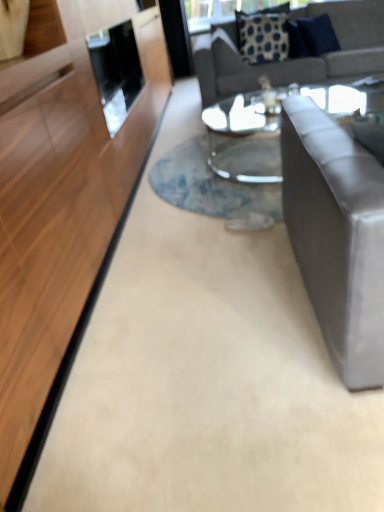
How much space does gray fabric couch at upper right, which is the 1th studio couch in top-to-bottom order, occupy horizontally?

It is 1.21 meters.

The width and height of the screenshot is (384, 512). Find the location of `clear glass coffee table at center`. clear glass coffee table at center is located at coordinates (244, 139).

You are a GUI agent. You are given a task and a screenshot of the screen. Output one action in this format:
    pyautogui.click(x=<x>, y=<y>)
    Task: Click on the blue fabric pillow at upper right, positioned as the 1th pillow in right-to-left order
    This screenshot has height=512, width=384.
    Given the screenshot: What is the action you would take?
    pyautogui.click(x=311, y=37)

The height and width of the screenshot is (512, 384). What do you see at coordinates (337, 236) in the screenshot? I see `satin gray couch at right, placed as the second studio couch when sorted from top to bottom` at bounding box center [337, 236].

The height and width of the screenshot is (512, 384). What are the coordinates of `gray fabric couch at upper right, the first studio couch when ordered from back to front` in the screenshot? It's located at (294, 59).

From a real-world perspective, which object rests below the other?

From a 3D spatial view, clear glass coffee table at center is below.

Is blue dotted fabric pillow at upper center, the second pillow in the right-to-left sequence, facing away from clear glass coffee table at center?

blue dotted fabric pillow at upper center, the second pillow in the right-to-left sequence, is not turned away from clear glass coffee table at center.

Is blue dotted fabric pillow at upper center, the 1th pillow in the left-to-right sequence, not inside clear glass coffee table at center?

Yes, blue dotted fabric pillow at upper center, the 1th pillow in the left-to-right sequence, is outside of clear glass coffee table at center.

Measure the distance from blue dotted fabric pillow at upper center, the 1th pillow in the left-to-right sequence, to blue fabric pillow at upper right, positioned as the 1th pillow in right-to-left order.

blue dotted fabric pillow at upper center, the 1th pillow in the left-to-right sequence, is 8.66 inches from blue fabric pillow at upper right, positioned as the 1th pillow in right-to-left order.

Which is closer, (252,25) or (323,24)?

Point (323,24)

From a real-world perspective, is blue dotted fabric pillow at upper center, the 1th pillow in the left-to-right sequence, physically above blue fabric pillow at upper right, positioned as the 1th pillow in right-to-left order?

Yes.

This screenshot has height=512, width=384. What are the coordinates of `pillow that is above the blue dotted fabric pillow at upper center, the second pillow in the right-to-left sequence (from the image's perspective)` in the screenshot? It's located at (311, 37).

In the image, is blue dotted fabric pillow at upper center, the second pillow in the right-to-left sequence, on the left side or the right side of satin gray couch at right, which appears as the 1th studio couch when ordered from the bottom?

In the image, blue dotted fabric pillow at upper center, the second pillow in the right-to-left sequence, appears on the right side of satin gray couch at right, which appears as the 1th studio couch when ordered from the bottom.

Looking at the image, does blue dotted fabric pillow at upper center, the second pillow in the right-to-left sequence, seem bigger or smaller compared to satin gray couch at right, which appears as the 1th studio couch when ordered from the bottom?

blue dotted fabric pillow at upper center, the second pillow in the right-to-left sequence, is smaller than satin gray couch at right, which appears as the 1th studio couch when ordered from the bottom.

Is satin gray couch at right, which appears as the 1th studio couch when ordered from the bottom, completely or partially inside blue dotted fabric pillow at upper center, the 1th pillow in the left-to-right sequence?

No, satin gray couch at right, which appears as the 1th studio couch when ordered from the bottom, is located outside of blue dotted fabric pillow at upper center, the 1th pillow in the left-to-right sequence.

Does clear glass coffee table at center have a smaller size compared to gray fabric couch at upper right, which appears as the second studio couch when viewed from the front?

Indeed, clear glass coffee table at center has a smaller size compared to gray fabric couch at upper right, which appears as the second studio couch when viewed from the front.

Would you say gray fabric couch at upper right, which appears as the second studio couch when viewed from the front, is part of clear glass coffee table at center's contents?

No, gray fabric couch at upper right, which appears as the second studio couch when viewed from the front, is not inside clear glass coffee table at center.

Between clear glass coffee table at center and gray fabric couch at upper right, the first studio couch when ordered from back to front, which one has smaller width?

gray fabric couch at upper right, the first studio couch when ordered from back to front, is thinner.

Is blue dotted fabric pillow at upper center, the 1th pillow in the left-to-right sequence, at the back of gray fabric couch at upper right, which is the 1th studio couch in top-to-bottom order?

A: That's right, gray fabric couch at upper right, which is the 1th studio couch in top-to-bottom order, is facing away from blue dotted fabric pillow at upper center, the 1th pillow in the left-to-right sequence.

In the scene shown: From a real-world perspective, which object rests below the other?

gray fabric couch at upper right, the second studio couch ordered from the bottom.

How different are the orientations of gray fabric couch at upper right, which is the 1th studio couch in top-to-bottom order, and blue dotted fabric pillow at upper center, the second pillow in the right-to-left sequence, in degrees?

The angular difference between gray fabric couch at upper right, which is the 1th studio couch in top-to-bottom order, and blue dotted fabric pillow at upper center, the second pillow in the right-to-left sequence, is 0.215 degrees.

From the image's perspective, is gray fabric couch at upper right, the second studio couch ordered from the bottom, located beneath blue dotted fabric pillow at upper center, the second pillow in the right-to-left sequence?

Yes.

The width and height of the screenshot is (384, 512). I want to click on coffee table on the left of blue fabric pillow at upper right, which is the 2th pillow from left to right, so click(244, 139).

Is clear glass coffee table at center not near blue fabric pillow at upper right, positioned as the 1th pillow in right-to-left order?

Yes, clear glass coffee table at center and blue fabric pillow at upper right, positioned as the 1th pillow in right-to-left order, are quite far apart.

From a real-world perspective, between clear glass coffee table at center and blue fabric pillow at upper right, positioned as the 1th pillow in right-to-left order, who is vertically higher?

From a 3D spatial view, blue fabric pillow at upper right, positioned as the 1th pillow in right-to-left order, is above.

Is blue fabric pillow at upper right, which is the 2th pillow from left to right, at the back of clear glass coffee table at center?

No, blue fabric pillow at upper right, which is the 2th pillow from left to right, is not at the back of clear glass coffee table at center.

Is the position of blue fabric pillow at upper right, which is the 2th pillow from left to right, less distant than that of blue dotted fabric pillow at upper center, the 1th pillow in the left-to-right sequence?

Yes, the depth of blue fabric pillow at upper right, which is the 2th pillow from left to right, is less than that of blue dotted fabric pillow at upper center, the 1th pillow in the left-to-right sequence.

At what (x,y) coordinates should I click in order to perform the action: click on pillow located on the right of blue dotted fabric pillow at upper center, the second pillow in the right-to-left sequence. Please return your answer as a coordinate pair (x, y). This screenshot has height=512, width=384. Looking at the image, I should click on (311, 37).

Between blue fabric pillow at upper right, positioned as the 1th pillow in right-to-left order, and blue dotted fabric pillow at upper center, the 1th pillow in the left-to-right sequence, which one has smaller width?

blue dotted fabric pillow at upper center, the 1th pillow in the left-to-right sequence, is thinner.

From a real-world perspective, is blue fabric pillow at upper right, positioned as the 1th pillow in right-to-left order, on blue dotted fabric pillow at upper center, the second pillow in the right-to-left sequence?

No, from a real-world perspective, blue fabric pillow at upper right, positioned as the 1th pillow in right-to-left order, is not over blue dotted fabric pillow at upper center, the second pillow in the right-to-left sequence

Locate an element on the screen. The image size is (384, 512). coffee table that appears in front of the blue dotted fabric pillow at upper center, the 1th pillow in the left-to-right sequence is located at coordinates (244, 139).

This screenshot has width=384, height=512. Find the location of `pillow that appears above the blue fabric pillow at upper right, positioned as the 1th pillow in right-to-left order (from a real-world perspective)`. pillow that appears above the blue fabric pillow at upper right, positioned as the 1th pillow in right-to-left order (from a real-world perspective) is located at coordinates (263, 34).

Based on their spatial positions, is clear glass coffee table at center or satin gray couch at right, which ranks as the 2th studio couch in back-to-front order, closer to gray fabric couch at upper right, the second studio couch ordered from the bottom?

clear glass coffee table at center lies closer to gray fabric couch at upper right, the second studio couch ordered from the bottom, than the other object.

Which object lies further to the anchor point blue fabric pillow at upper right, which is the 2th pillow from left to right, satin gray couch at right, placed as the second studio couch when sorted from top to bottom, or gray fabric couch at upper right, the second studio couch ordered from the bottom?

satin gray couch at right, placed as the second studio couch when sorted from top to bottom, is further to blue fabric pillow at upper right, which is the 2th pillow from left to right.

Which object lies further to the anchor point gray fabric couch at upper right, the second studio couch ordered from the bottom, satin gray couch at right, which appears as the 1th studio couch when ordered from the bottom, or blue dotted fabric pillow at upper center, the second pillow in the right-to-left sequence?

satin gray couch at right, which appears as the 1th studio couch when ordered from the bottom, is further to gray fabric couch at upper right, the second studio couch ordered from the bottom.

Based on their spatial positions, is blue fabric pillow at upper right, which is the 2th pillow from left to right, or satin gray couch at right, which ranks as the 2th studio couch in back-to-front order, closer to blue dotted fabric pillow at upper center, the 1th pillow in the left-to-right sequence?

blue fabric pillow at upper right, which is the 2th pillow from left to right, is positioned closer to the anchor blue dotted fabric pillow at upper center, the 1th pillow in the left-to-right sequence.

Estimate the real-world distances between objects in this image. Which object is closer to clear glass coffee table at center, blue fabric pillow at upper right, which is the 2th pillow from left to right, or blue dotted fabric pillow at upper center, the 1th pillow in the left-to-right sequence?

Among the two, blue dotted fabric pillow at upper center, the 1th pillow in the left-to-right sequence, is located nearer to clear glass coffee table at center.

From the image, which object appears to be nearer to satin gray couch at right, which ranks as the 2th studio couch in back-to-front order, clear glass coffee table at center or gray fabric couch at upper right, which appears as the second studio couch when viewed from the front?

Based on the image, clear glass coffee table at center appears to be nearer to satin gray couch at right, which ranks as the 2th studio couch in back-to-front order.

Estimate the real-world distances between objects in this image. Which object is closer to blue dotted fabric pillow at upper center, the 1th pillow in the left-to-right sequence, satin gray couch at right, acting as the 1th studio couch starting from the front, or gray fabric couch at upper right, which appears as the second studio couch when viewed from the front?

gray fabric couch at upper right, which appears as the second studio couch when viewed from the front.

Based on their spatial positions, is gray fabric couch at upper right, which appears as the second studio couch when viewed from the front, or clear glass coffee table at center closer to blue dotted fabric pillow at upper center, the second pillow in the right-to-left sequence?

gray fabric couch at upper right, which appears as the second studio couch when viewed from the front, is closer to blue dotted fabric pillow at upper center, the second pillow in the right-to-left sequence.

Where is `pillow between clear glass coffee table at center and blue dotted fabric pillow at upper center, the 1th pillow in the left-to-right sequence, in the front-back direction`? This screenshot has height=512, width=384. pillow between clear glass coffee table at center and blue dotted fabric pillow at upper center, the 1th pillow in the left-to-right sequence, in the front-back direction is located at coordinates (311, 37).

Locate an element on the screen. coffee table between satin gray couch at right, acting as the 1th studio couch starting from the front, and blue dotted fabric pillow at upper center, the 1th pillow in the left-to-right sequence, from front to back is located at coordinates (244, 139).

Where is `studio couch between satin gray couch at right, acting as the 1th studio couch starting from the front, and blue dotted fabric pillow at upper center, the 1th pillow in the left-to-right sequence, in the front-back direction`? studio couch between satin gray couch at right, acting as the 1th studio couch starting from the front, and blue dotted fabric pillow at upper center, the 1th pillow in the left-to-right sequence, in the front-back direction is located at coordinates (294, 59).

Where is `studio couch between satin gray couch at right, which ranks as the 2th studio couch in back-to-front order, and blue fabric pillow at upper right, which is the 2th pillow from left to right, in the front-back direction`? Image resolution: width=384 pixels, height=512 pixels. studio couch between satin gray couch at right, which ranks as the 2th studio couch in back-to-front order, and blue fabric pillow at upper right, which is the 2th pillow from left to right, in the front-back direction is located at coordinates (294, 59).